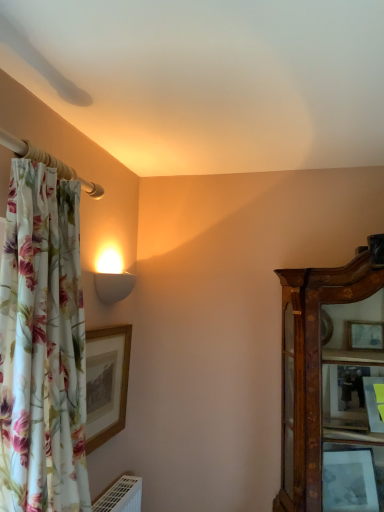
Measure the distance between point [117,406] and camera.

Point [117,406] and camera are 6.31 feet apart from each other.

Where is `wooden framed print at left`? The width and height of the screenshot is (384, 512). wooden framed print at left is located at coordinates (106, 382).

Image resolution: width=384 pixels, height=512 pixels. Describe the element at coordinates (106, 382) in the screenshot. I see `wooden framed print at left` at that location.

You are a GUI agent. You are given a task and a screenshot of the screen. Output one action in this format:
    pyautogui.click(x=<x>, y=<y>)
    Task: Click on the wooden framed print at left
    
    Given the screenshot: What is the action you would take?
    pyautogui.click(x=106, y=382)